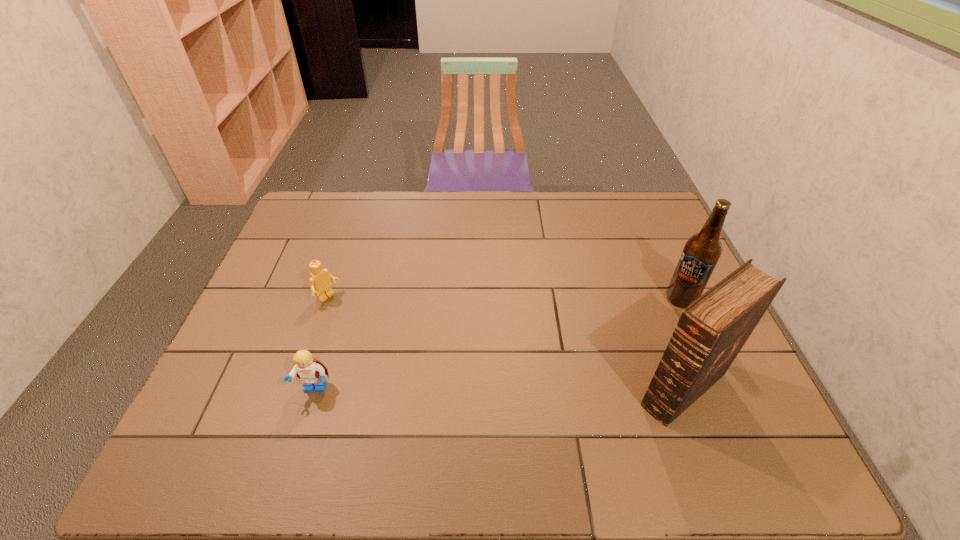
I want to click on the nearer Lego, so click(310, 371).

You are a GUI agent. You are given a task and a screenshot of the screen. Output one action in this format:
    pyautogui.click(x=<x>, y=<y>)
    Task: Click on the Bible
    
    Given the screenshot: What is the action you would take?
    (711, 331)

Identify the location of beer bottle. This screenshot has height=540, width=960. (702, 251).

This screenshot has width=960, height=540. In order to click on the farther Lego in this screenshot , I will do `click(320, 283)`.

Identify the location of vacant region located on the back of the Bible. The height and width of the screenshot is (540, 960). click(633, 256).

What are the coordinates of `vacant area situated on the label of the beer bottle` in the screenshot? It's located at (634, 332).

The image size is (960, 540). What are the coordinates of `free region located 0.360m on the label of the beer bottle` in the screenshot? It's located at (579, 368).

This screenshot has width=960, height=540. In order to click on vacant space located 0.380m on the label of the beer bottle in this screenshot , I will do `click(573, 373)`.

Where is `blank area located on the face of the farther Lego`? blank area located on the face of the farther Lego is located at coordinates (371, 332).

The width and height of the screenshot is (960, 540). What are the coordinates of `free space located on the face of the farther Lego` in the screenshot? It's located at (371, 332).